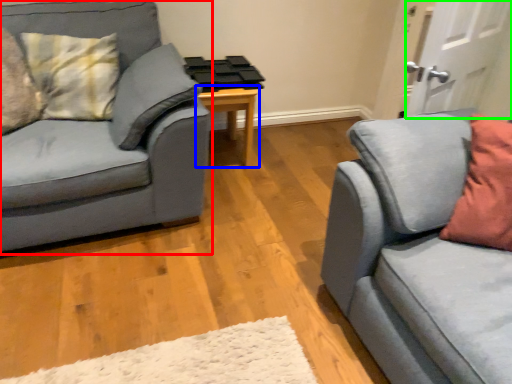
Question: Based on their relative distances, which object is farther from studio couch (highlighted by a red box)? Choose from table (highlighted by a blue box) and door (highlighted by a green box).

Choices:
 (A) table
 (B) door

Answer: (B)